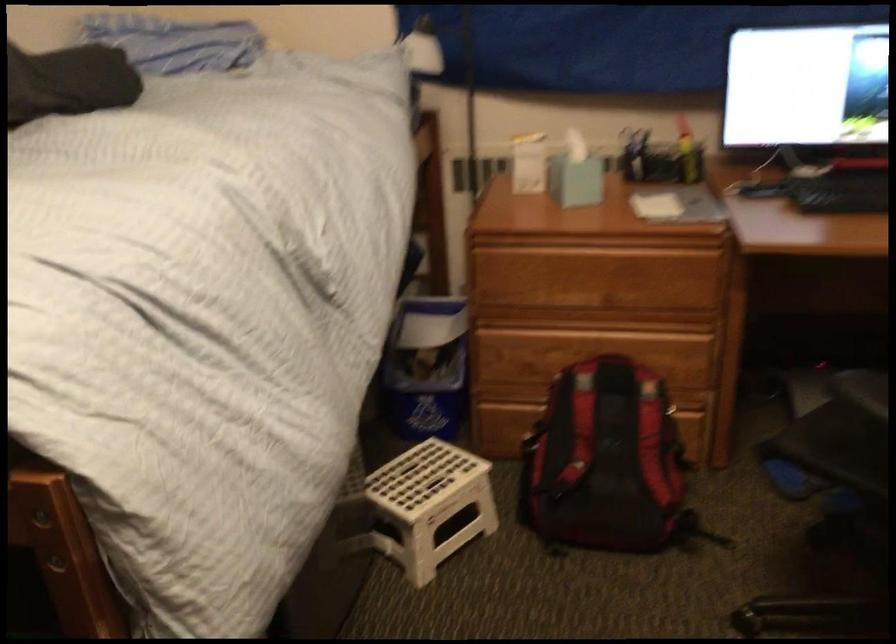
Where would you lift the red and black backpack? Please return your answer as a coordinate pair (x, y).

(606, 462)